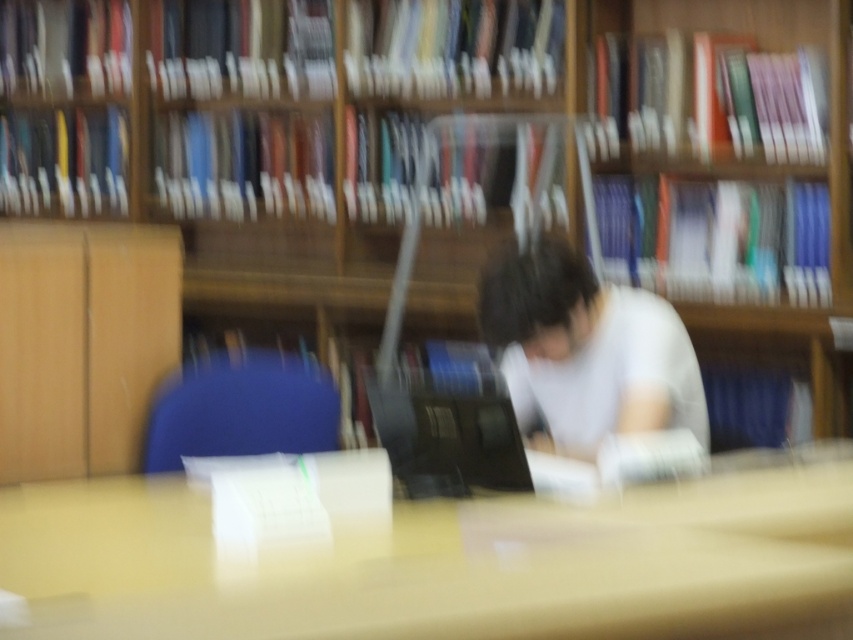
Is point (24, 568) positioned behind point (556, 442)?

No, it is not.

Is smooth wooden table at center shorter than white matte shirt at center?

Yes, smooth wooden table at center is shorter than white matte shirt at center.

What do you see at coordinates (444, 564) in the screenshot? I see `smooth wooden table at center` at bounding box center [444, 564].

The height and width of the screenshot is (640, 853). Find the location of `smooth wooden table at center`. smooth wooden table at center is located at coordinates (444, 564).